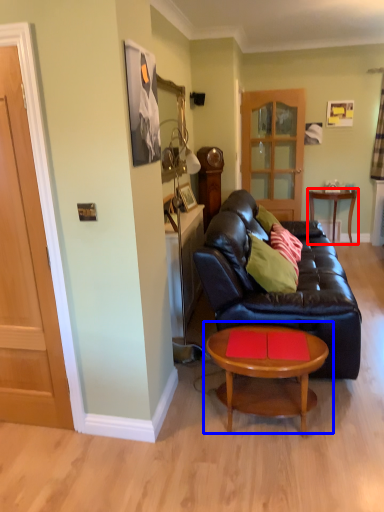
Question: Which object appears farthest to the camera in this image, table (highlighted by a red box) or coffee table (highlighted by a blue box)?

Choices:
 (A) table
 (B) coffee table

Answer: (A)